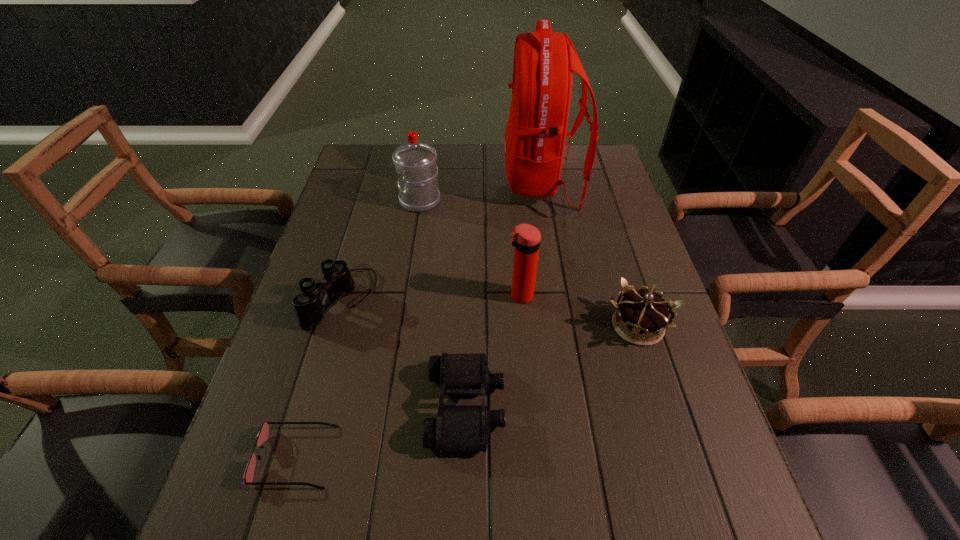
Select which object is the sixth closest to the nearer binoculars. Please provide its 2D coordinates. Your answer should be formatted as a tuple, i.e. [(x, y)], where the tuple contains the x and y coordinates of a point satisfying the conditions above.

[(415, 162)]

Identify which object is the fifth nearest to the sunglasses. Please provide its 2D coordinates. Your answer should be formatted as a tuple, i.e. [(x, y)], where the tuple contains the x and y coordinates of a point satisfying the conditions above.

[(415, 162)]

Identify the location of free space that satisfies the following two spatial constraints: 1. on the handle side of the water bottle; 2. on the left side of the thermos bottle. This screenshot has height=540, width=960. (405, 295).

This screenshot has height=540, width=960. What are the coordinates of `free space that satisfies the following two spatial constraints: 1. on the handle side of the crown; 2. on the left side of the fifth object from right to left` in the screenshot? It's located at (400, 326).

Where is `free region that satisfies the following two spatial constraints: 1. on the handle side of the water bottle; 2. on the front side of the farther binoculars`? The height and width of the screenshot is (540, 960). free region that satisfies the following two spatial constraints: 1. on the handle side of the water bottle; 2. on the front side of the farther binoculars is located at coordinates (405, 297).

I want to click on blank area in the image that satisfies the following two spatial constraints: 1. on the handle side of the water bottle; 2. on the right side of the thermos bottle, so coord(405,295).

You are a GUI agent. You are given a task and a screenshot of the screen. Output one action in this format:
    pyautogui.click(x=<x>, y=<y>)
    Task: Click on the free location that satisfies the following two spatial constraints: 1. on the handle side of the fifth object from right to left; 2. on the back side of the crown
    The image size is (960, 540).
    Given the screenshot: What is the action you would take?
    pyautogui.click(x=400, y=326)